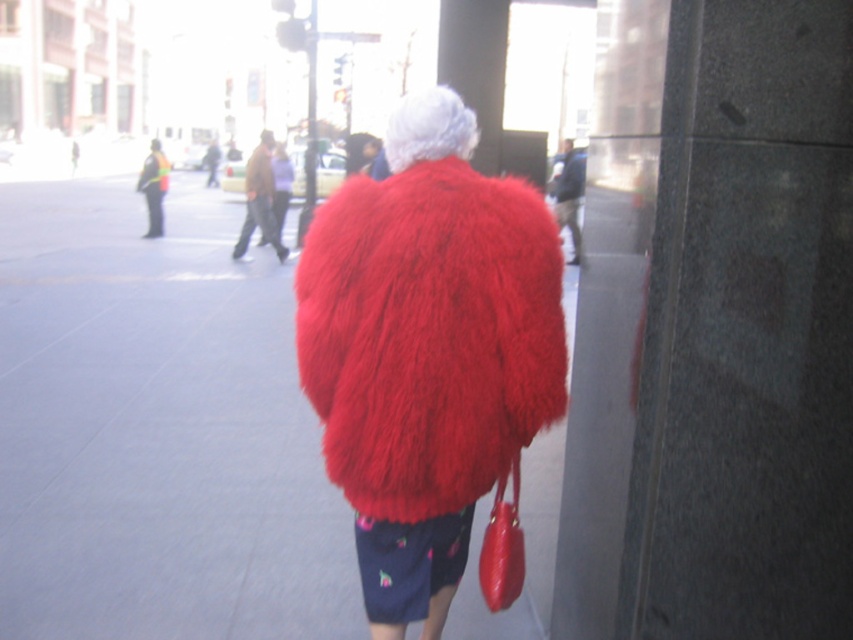
You are a photographer trying to capture the person in the scene. You want to ensure both the fuzzy red coat at center and the shiny red handbag at lower right are clearly visible in your shot. Which object should you focus on first to ensure both are in frame?

The fuzzy red coat at center is positioned on the left side of the shiny red handbag at lower right, so focusing on the fuzzy red coat at center first will help ensure both objects remain in frame as you adjust your shot.

You are a photographer trying to capture the person in the red fluffy coat at center without including the shiny red handbag at lower right in the shot. Based on their positions, is this possible?

The red fluffy coat at center is in front of the shiny red handbag at lower right, so it is possible to capture the person in the red fluffy coat at center without including the shiny red handbag at lower right by focusing on the foreground where the coat is positioned.